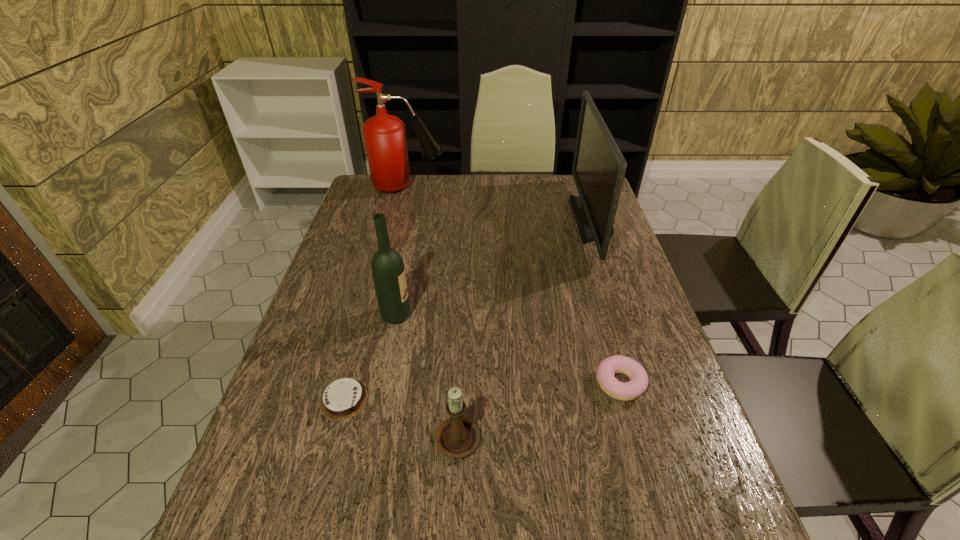
Identify the location of empty space that is in between the fire extinguisher and the wine bottle. (401, 251).

Where is `vacant area that lies between the fourth nearest object and the candle holder`? vacant area that lies between the fourth nearest object and the candle holder is located at coordinates (427, 375).

This screenshot has width=960, height=540. Identify the location of free space between the fourth nearest object and the fire extinguisher. (401, 251).

Locate an element on the screen. Image resolution: width=960 pixels, height=540 pixels. blank region between the second shortest object and the wine bottle is located at coordinates point(508,349).

The height and width of the screenshot is (540, 960). What are the coordinates of `vacant region between the fire extinguisher and the fifth tallest object` in the screenshot? It's located at (514, 285).

This screenshot has height=540, width=960. Find the location of `vacant space that is in between the third shortest object and the doughnut`. vacant space that is in between the third shortest object and the doughnut is located at coordinates (539, 409).

You are a GUI agent. You are given a task and a screenshot of the screen. Output one action in this format:
    pyautogui.click(x=<x>, y=<y>)
    Task: Click on the empty space that is in between the third object from right to left and the doughnut
    The width and height of the screenshot is (960, 540).
    Given the screenshot: What is the action you would take?
    pyautogui.click(x=539, y=409)

You are a GUI agent. You are given a task and a screenshot of the screen. Output one action in this format:
    pyautogui.click(x=<x>, y=<y>)
    Task: Click on the unoccupied position between the shortest object and the candle holder
    
    Given the screenshot: What is the action you would take?
    pyautogui.click(x=401, y=417)

The height and width of the screenshot is (540, 960). Identify the location of object that is the nearest to the fourth tallest object. (344, 398).

Locate which object is the second closest to the fire extinguisher. Please provide its 2D coordinates. Your answer should be formatted as a tuple, i.e. [(x, y)], where the tuple contains the x and y coordinates of a point satisfying the conditions above.

[(387, 266)]